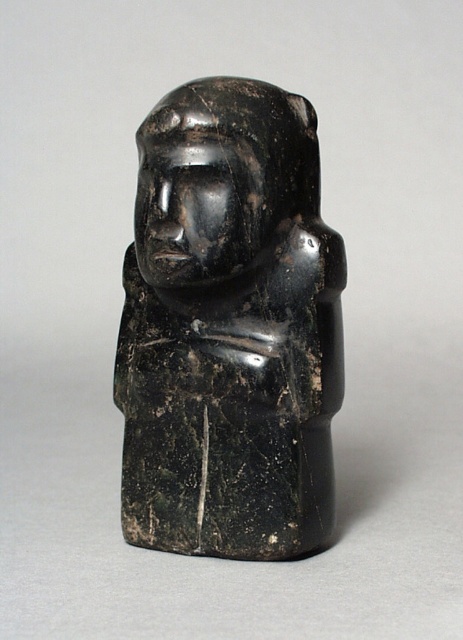
You are an archaeologist examining the image of an ancient artifact. You notice two objects labeled black stone figure at center and black stone head at center. According to the spatial arrangement, which object is positioned to the left?

The black stone figure at center is to the left of the black stone head at center.

You are an archaeologist examining the black stone figure at center and the black stone head at center. Which object would you need a larger storage container for?

The black stone figure at center requires a larger storage container because it has a larger size compared to the black stone head at center.